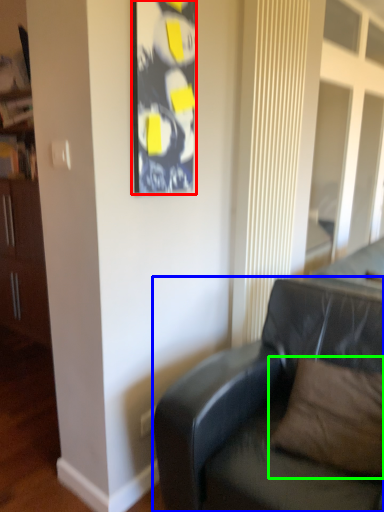
Question: Which object is positioned farthest from picture frame (highlighted by a red box)? Select from studio couch (highlighted by a blue box) and pillow (highlighted by a green box).

Choices:
 (A) studio couch
 (B) pillow

Answer: (B)